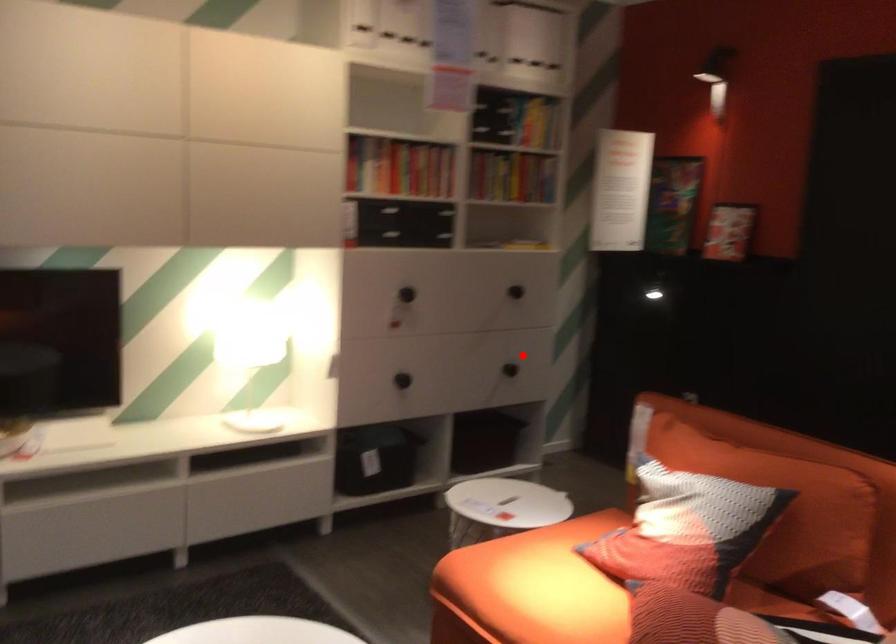
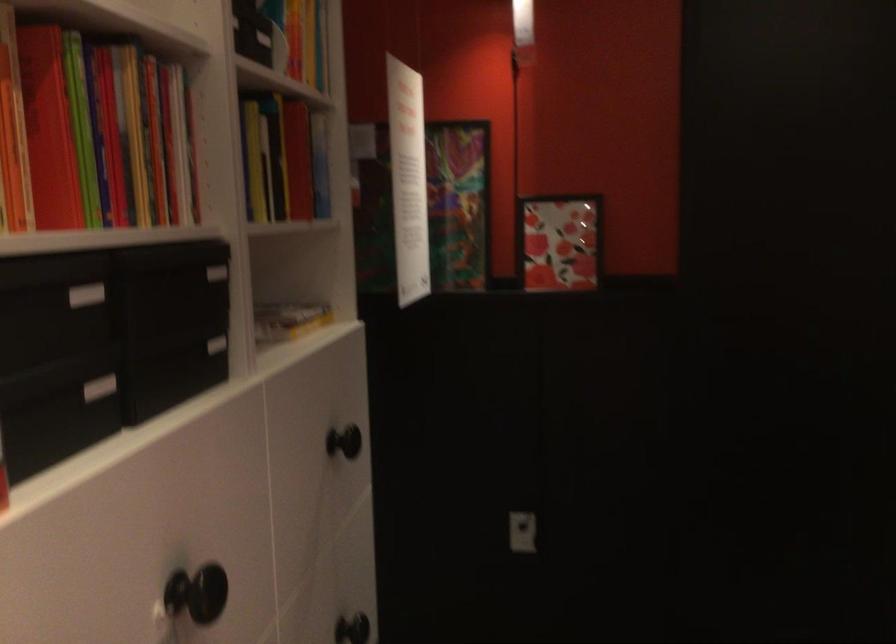
Find the pixel in the second image that matches the highlighted location in the first image.

(351, 629)